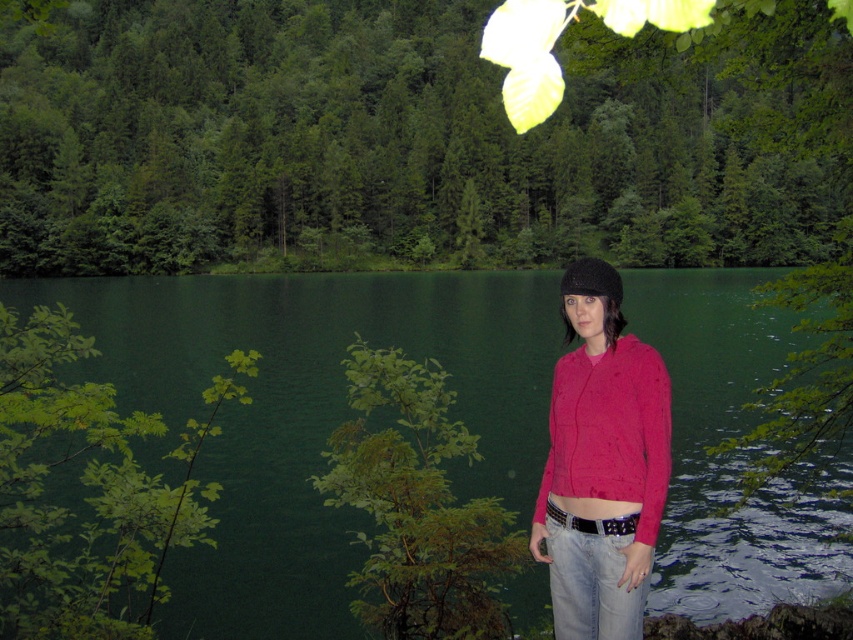
You are a photographer aiming to capture the entire scene in one shot. You notice the green leafy tree at upper center and the green leafy branch at left. Which object is wider?

The green leafy tree at upper center is wider than the green leafy branch at left.

You are a hiker who wants to take a photo of the point at coordinates (412, 138) in the scene. Based on the description, where should you aim your camera to capture this point?

The point at coordinates (412, 138) is located on the green leafy tree at upper center, so aim your camera towards the upper center area of the tree to capture it.

You are a photographer trying to capture the black fuzzy hat at center and the green leafy bush at lower left in the same frame. Which object will appear wider in your photo?

The green leafy bush at lower left appears wider in the photo because its width is larger than the black fuzzy hat at center.